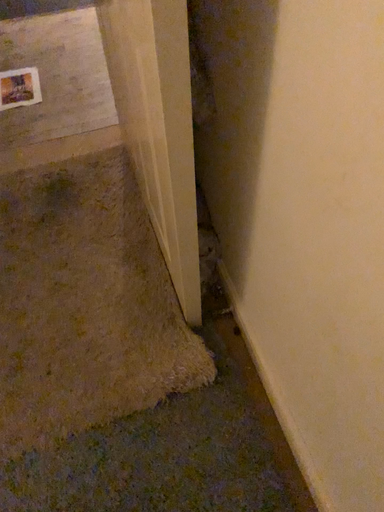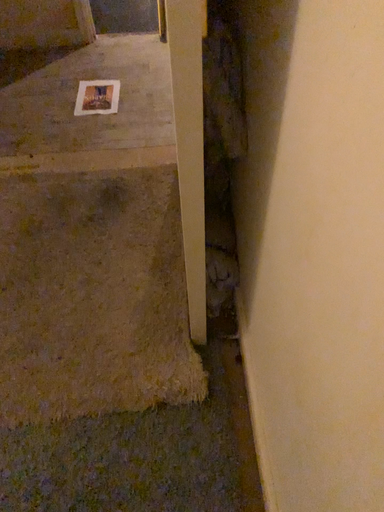
Question: How did the camera likely rotate when shooting the video?

Choices:
 (A) rotated left
 (B) rotated right

Answer: (A)